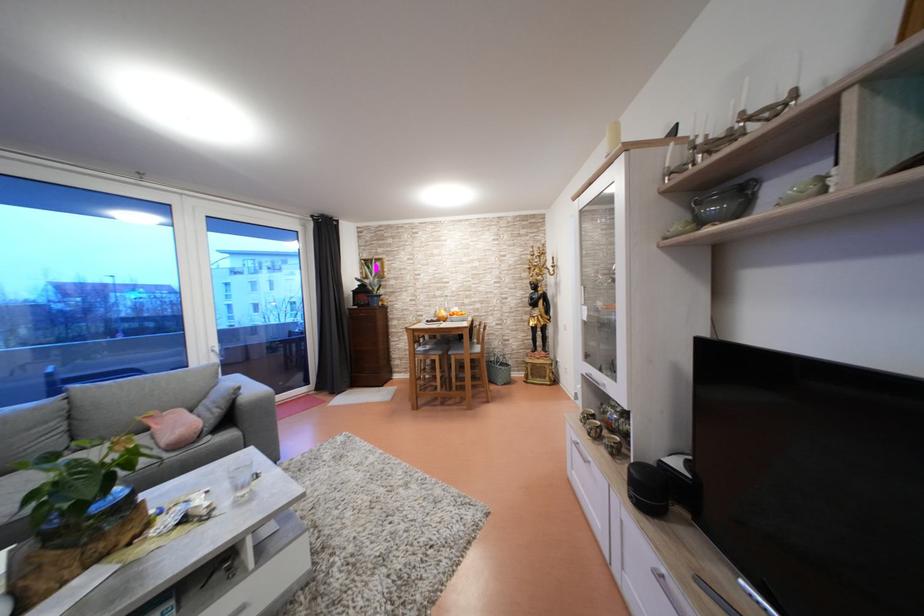
The height and width of the screenshot is (616, 924). What do you see at coordinates (252, 411) in the screenshot?
I see `a grey sofa armrest` at bounding box center [252, 411].